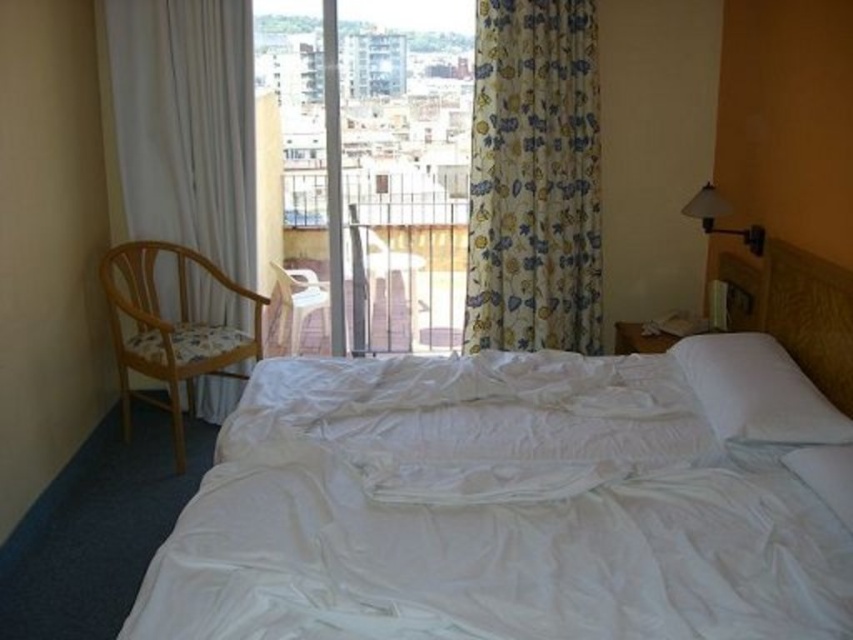
Question: Is wooden textured armchair at left smaller than white plastic armchair at center?

Choices:
 (A) yes
 (B) no

Answer: (B)

Question: Estimate the real-world distances between objects in this image. Which object is closer to the wooden textured armchair at left?

Choices:
 (A) floral fabric curtain at upper center
 (B) white soft pillow at upper right
 (C) white fabric curtain at left

Answer: (C)

Question: Which of the following is the closest to the observer?

Choices:
 (A) (281, 324)
 (B) (708, 349)
 (C) (286, 588)
 (D) (350, 225)

Answer: (C)

Question: Where is transparent glass door at center located in relation to metallic silver armchair at center in the image?

Choices:
 (A) below
 (B) above

Answer: (B)

Question: Which of the following is the farthest from the observer?

Choices:
 (A) white soft pillow at upper right
 (B) transparent glass door at center
 (C) wooden textured armchair at left
 (D) white fabric curtain at left

Answer: (B)

Question: Can you confirm if white fabric curtain at left is bigger than white plastic armchair at center?

Choices:
 (A) no
 (B) yes

Answer: (B)